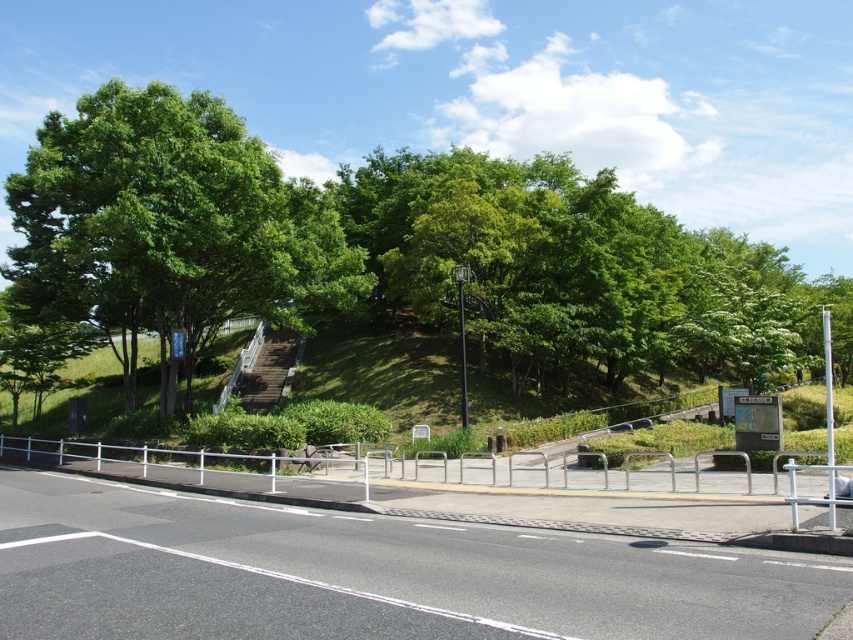
Question: Does green leafy tree at upper center appear on the left side of black metal pole at center?

Choices:
 (A) no
 (B) yes

Answer: (A)

Question: Which point is farther from the camera taking this photo?

Choices:
 (A) (222, 186)
 (B) (456, 273)

Answer: (B)

Question: Does green leafy tree at upper center appear on the right side of black metal pole at center?

Choices:
 (A) no
 (B) yes

Answer: (B)

Question: Is green leafy tree at upper center wider than black metal pole at center?

Choices:
 (A) yes
 (B) no

Answer: (A)

Question: Which object is farther from the camera taking this photo?

Choices:
 (A) black metal pole at center
 (B) green leafy tree at upper center

Answer: (A)